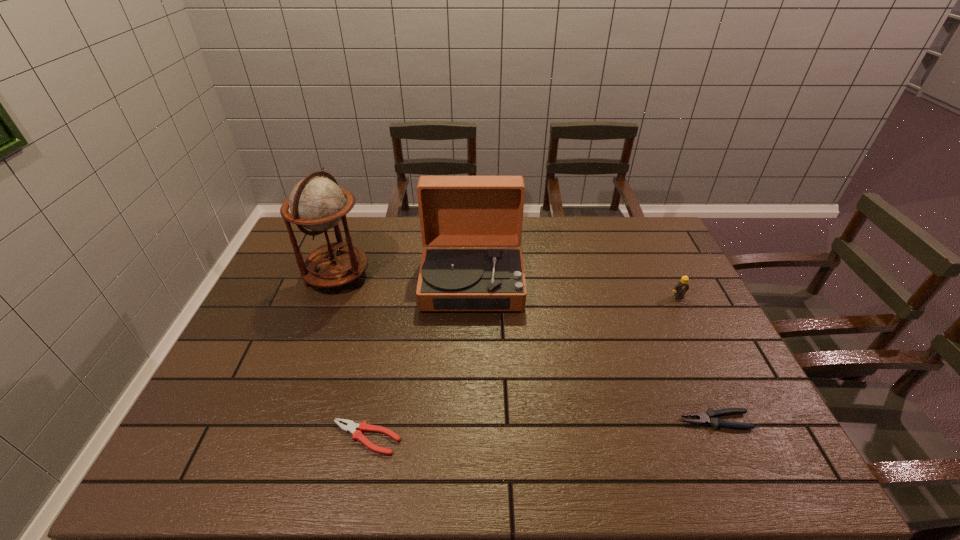
Where is `vacant area situated in front of the third tallest object`? This screenshot has width=960, height=540. vacant area situated in front of the third tallest object is located at coordinates (706, 353).

In order to click on vacant space located at the gripping part of the fourth tallest object in this screenshot , I will do `click(588, 421)`.

Image resolution: width=960 pixels, height=540 pixels. I want to click on vacant region located at the gripping part of the fourth tallest object, so click(592, 421).

Locate an element on the screen. The height and width of the screenshot is (540, 960). vacant space located at the gripping part of the fourth tallest object is located at coordinates (592, 421).

I want to click on vacant area located on the left of the shortest object, so click(x=190, y=438).

You are a GUI agent. You are given a task and a screenshot of the screen. Output one action in this format:
    pyautogui.click(x=<x>, y=<y>)
    Task: Click on the globe at the far edge
    
    Given the screenshot: What is the action you would take?
    pyautogui.click(x=316, y=203)

Where is `phonograph record that is at the far edge`? The width and height of the screenshot is (960, 540). phonograph record that is at the far edge is located at coordinates (455, 211).

The height and width of the screenshot is (540, 960). In order to click on object situated at the near edge in this screenshot , I will do `click(351, 427)`.

Where is `object located at the left edge`? The image size is (960, 540). object located at the left edge is located at coordinates (316, 203).

Where is `Lego that is at the right edge`? Lego that is at the right edge is located at coordinates (681, 287).